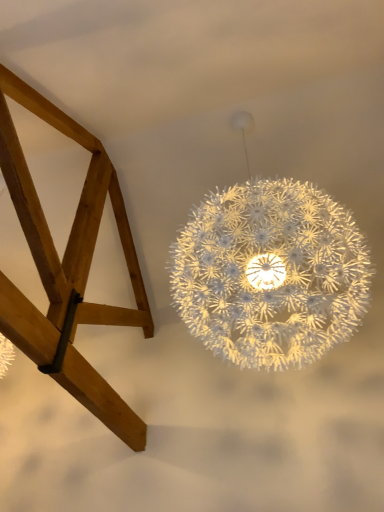
Question: Does light brown wood frame at lower left turn towards white matte spherical lamp at center?

Choices:
 (A) yes
 (B) no

Answer: (B)

Question: From the image's perspective, does light brown wood frame at lower left appear lower than white matte spherical lamp at center?

Choices:
 (A) no
 (B) yes

Answer: (B)

Question: Considering the relative positions of light brown wood frame at lower left and white matte spherical lamp at center in the image provided, is light brown wood frame at lower left to the right of white matte spherical lamp at center from the viewer's perspective?

Choices:
 (A) no
 (B) yes

Answer: (A)

Question: Can you confirm if light brown wood frame at lower left is bigger than white matte spherical lamp at center?

Choices:
 (A) no
 (B) yes

Answer: (A)

Question: Can you confirm if light brown wood frame at lower left is wider than white matte spherical lamp at center?

Choices:
 (A) no
 (B) yes

Answer: (B)

Question: Is white matte spherical lamp at center completely or partially inside light brown wood frame at lower left?

Choices:
 (A) yes
 (B) no

Answer: (B)

Question: From the image's perspective, is white matte spherical lamp at center above light brown wood frame at lower left?

Choices:
 (A) no
 (B) yes

Answer: (B)

Question: Does white matte spherical lamp at center touch light brown wood frame at lower left?

Choices:
 (A) no
 (B) yes

Answer: (A)

Question: Is white matte spherical lamp at center closer to the viewer compared to light brown wood frame at lower left?

Choices:
 (A) yes
 (B) no

Answer: (B)

Question: Considering the relative sizes of white matte spherical lamp at center and light brown wood frame at lower left in the image provided, is white matte spherical lamp at center shorter than light brown wood frame at lower left?

Choices:
 (A) yes
 (B) no

Answer: (B)

Question: Does white matte spherical lamp at center appear on the left side of light brown wood frame at lower left?

Choices:
 (A) no
 (B) yes

Answer: (A)

Question: Is light brown wood frame at lower left inside white matte spherical lamp at center?

Choices:
 (A) no
 (B) yes

Answer: (A)

Question: Looking at their shapes, would you say white matte spherical lamp at center is wider or thinner than light brown wood frame at lower left?

Choices:
 (A) thin
 (B) wide

Answer: (A)